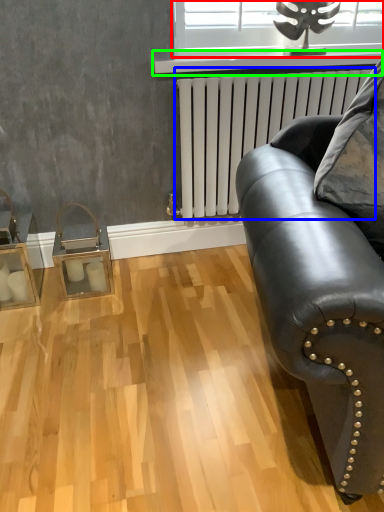
Question: Which object is the closest to the window (highlighted by a red box)? Choose among these: radiator (highlighted by a blue box) or window sill (highlighted by a green box).

Choices:
 (A) radiator
 (B) window sill

Answer: (B)